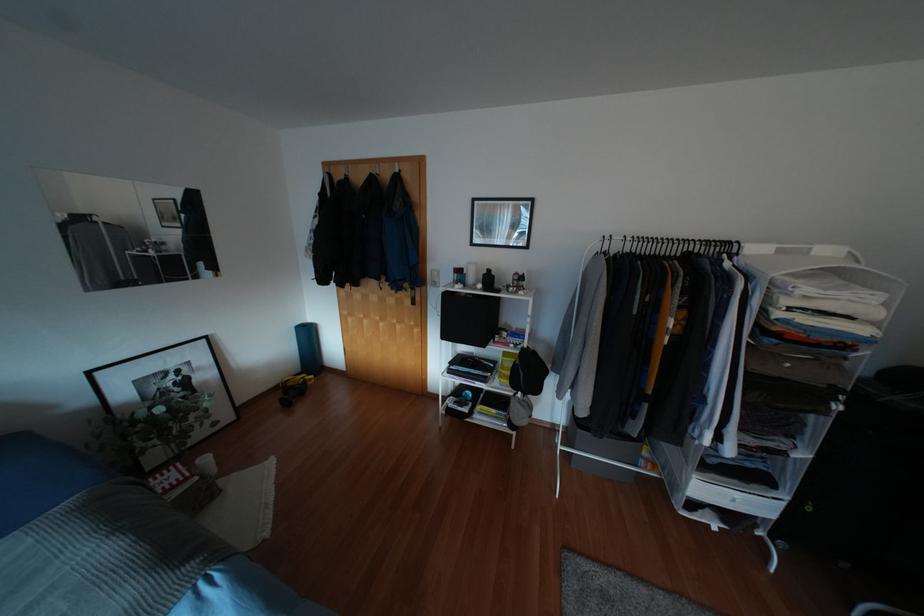
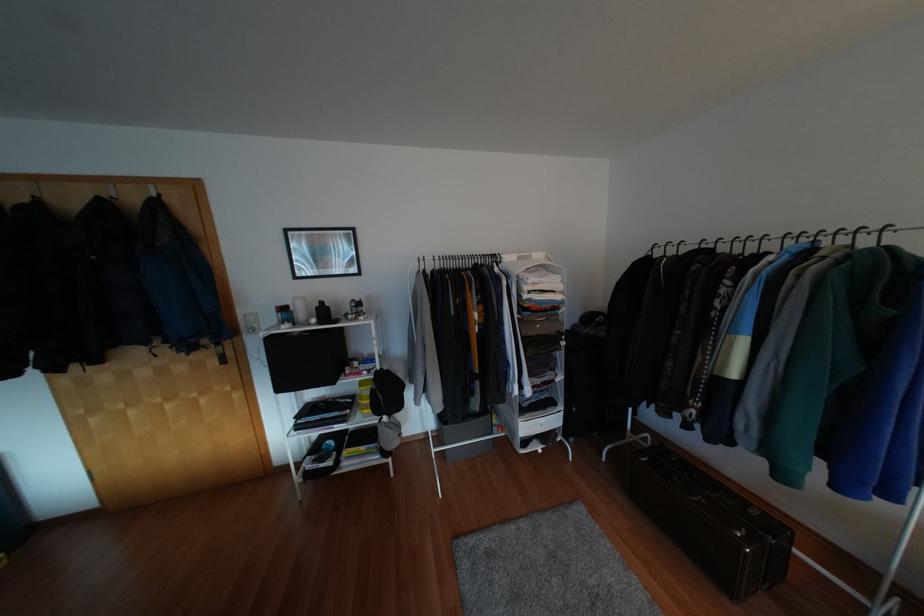
Question: The images are taken continuously from a first-person perspective. In which direction is your viewpoint rotating?

Choices:
 (A) Left
 (B) Right
 (C) Up
 (D) Down

Answer: (B)